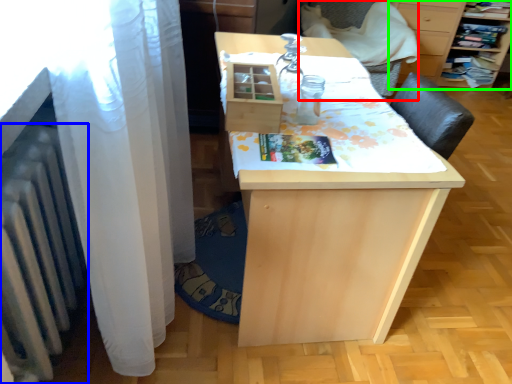
Question: Estimate the real-world distances between objects in this image. Which object is closer to armchair (highlighted by a red box), radiator (highlighted by a blue box) or furniture (highlighted by a green box)?

Choices:
 (A) radiator
 (B) furniture

Answer: (B)